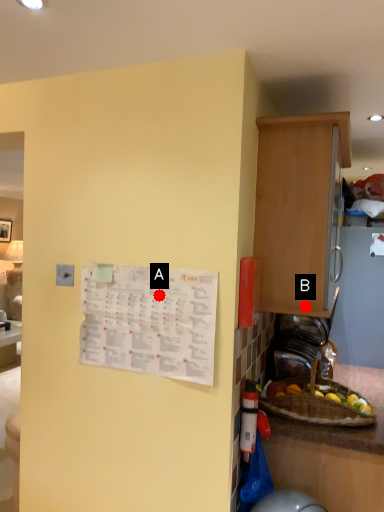
Question: Two points are circled on the image, labeled by A and B beside each circle. Which of the following is the closest to the observer?

Choices:
 (A) A is closer
 (B) B is closer

Answer: (A)